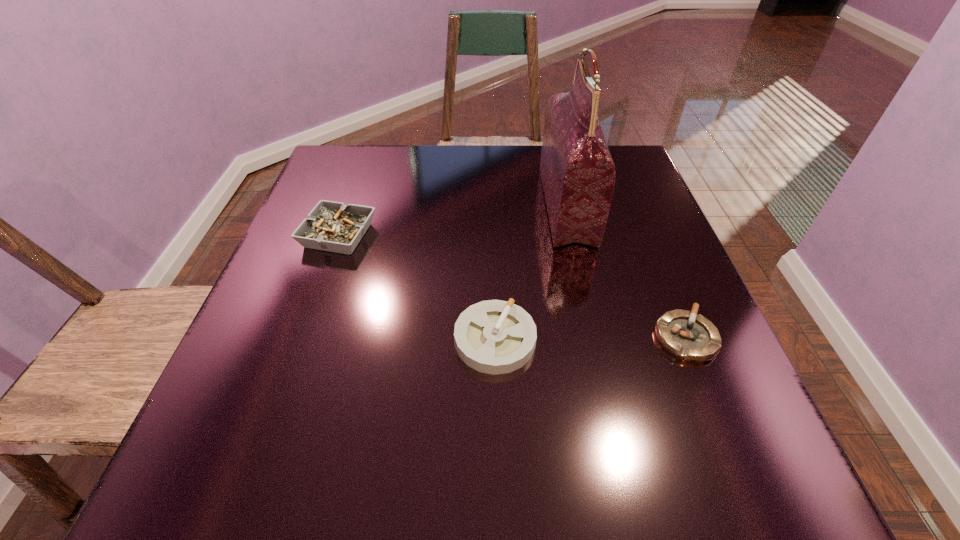
Identify the location of vacant area situated 0.140m on the right of the leftmost object. This screenshot has width=960, height=540. (438, 235).

Locate an element on the screen. The width and height of the screenshot is (960, 540). free space located 0.320m on the right of the second ashtray from left to right is located at coordinates (718, 340).

Find the location of a particular element. The height and width of the screenshot is (540, 960). vacant space situated 0.170m on the left of the rightmost ashtray is located at coordinates (558, 338).

This screenshot has height=540, width=960. I want to click on object situated at the far edge, so click(577, 172).

Locate an element on the screen. This screenshot has height=540, width=960. object that is at the left edge is located at coordinates (331, 226).

The width and height of the screenshot is (960, 540). What are the coordinates of `handbag at the right edge` in the screenshot? It's located at tap(577, 172).

Locate an element on the screen. Image resolution: width=960 pixels, height=540 pixels. ashtray that is at the right edge is located at coordinates tap(690, 337).

What are the coordinates of `object located in the far right corner section of the desktop` in the screenshot? It's located at (577, 172).

Locate an element on the screen. This screenshot has width=960, height=540. free space at the far edge is located at coordinates (463, 182).

Identify the location of free space at the left edge. (360, 196).